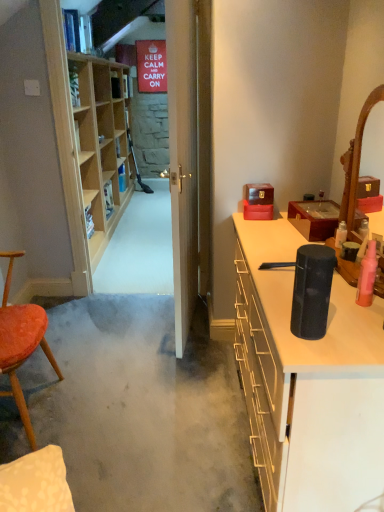
Find the location of a particular element. Image resolution: width=384 pixels, height=512 pixels. free spot in front of black matte speaker at right is located at coordinates [x=317, y=351].